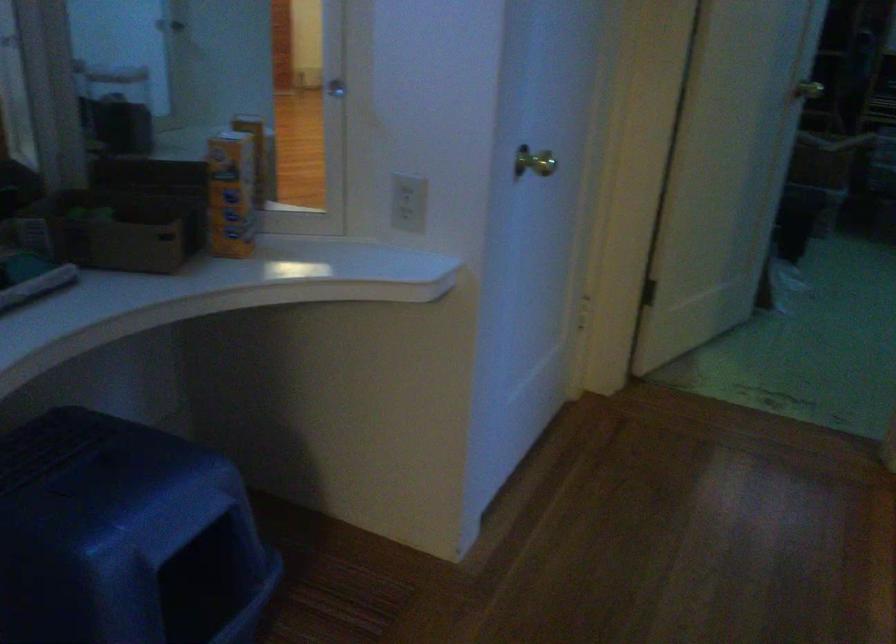
The width and height of the screenshot is (896, 644). What do you see at coordinates (409, 202) in the screenshot?
I see `the white electrical outlet` at bounding box center [409, 202].